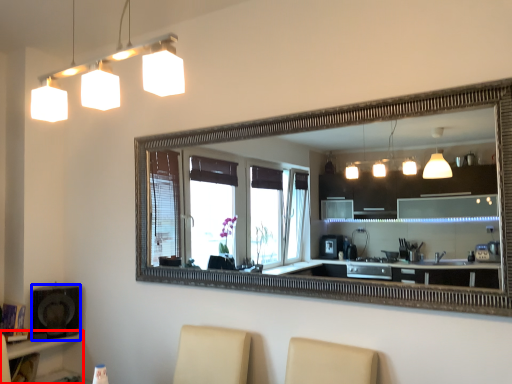
Question: Among these objects, which one is nearest to the camera, vanity (highlighted by a red box) or speaker (highlighted by a blue box)?

Choices:
 (A) vanity
 (B) speaker

Answer: (A)